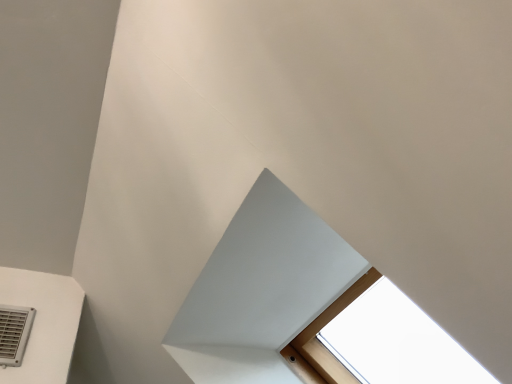
Question: Is point (28, 316) closer or farther from the camera than point (227, 231)?

Choices:
 (A) farther
 (B) closer

Answer: (A)

Question: From a real-world perspective, is gray plastic air conditioning at lower left physically located above or below white matte exhaust hood at center?

Choices:
 (A) below
 (B) above

Answer: (B)

Question: Is gray plastic air conditioning at lower left inside or outside of white matte exhaust hood at center?

Choices:
 (A) inside
 (B) outside

Answer: (B)

Question: Considering their positions, is white matte exhaust hood at center located in front of or behind gray plastic air conditioning at lower left?

Choices:
 (A) front
 (B) behind

Answer: (A)

Question: Is white matte exhaust hood at center wider or thinner than gray plastic air conditioning at lower left?

Choices:
 (A) wide
 (B) thin

Answer: (A)

Question: Does point (209, 365) appear closer or farther from the camera than point (7, 329)?

Choices:
 (A) farther
 (B) closer

Answer: (B)

Question: In terms of size, does white matte exhaust hood at center appear bigger or smaller than gray plastic air conditioning at lower left?

Choices:
 (A) small
 (B) big

Answer: (B)